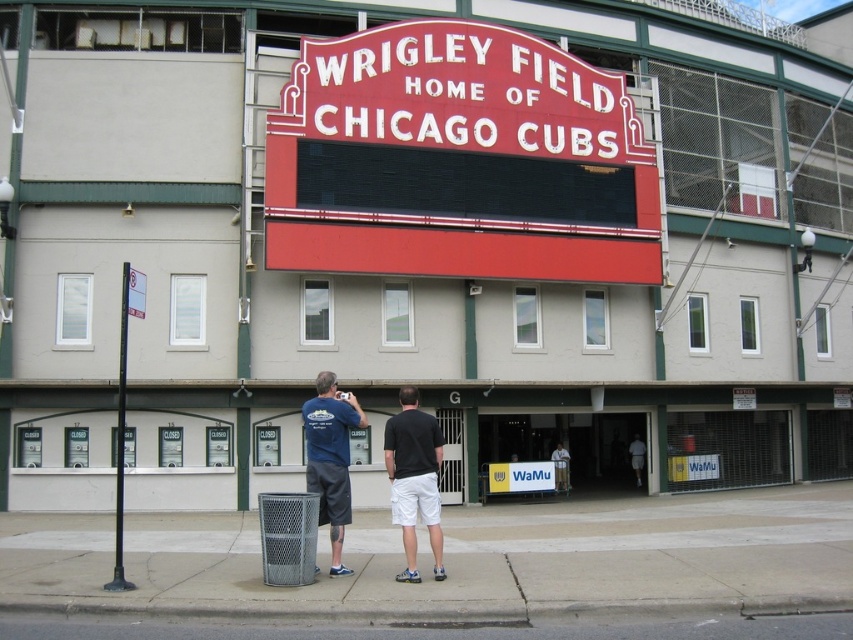
Between dark blue t-shirt at center and black cotton shorts at center, which one is positioned higher?

Positioned higher is dark blue t-shirt at center.

Is dark blue t-shirt at center positioned at the back of black cotton shorts at center?

Answer: That is False.

Does point (396, 442) lie behind point (408, 406)?

That is False.

Locate an element on the screen. This screenshot has width=853, height=640. dark blue t-shirt at center is located at coordinates (415, 477).

Is red matte sign at center thinner than dark blue t-shirt at center?

Incorrect, red matte sign at center's width is not less than dark blue t-shirt at center's.

What are the coordinates of `red matte sign at center` in the screenshot? It's located at (457, 161).

I want to click on red matte sign at center, so click(x=457, y=161).

Is black cotton shorts at center to the left of matte blue t-shirt at center from the viewer's perspective?

Incorrect, black cotton shorts at center is not on the left side of matte blue t-shirt at center.

Is point (404, 461) in front of point (329, 428)?

Yes, it is in front of point (329, 428).

Between point (424, 412) and point (310, 484), which one is positioned behind?

The point (424, 412) is behind.

The width and height of the screenshot is (853, 640). In order to click on black cotton shorts at center in this screenshot , I will do point(415,477).